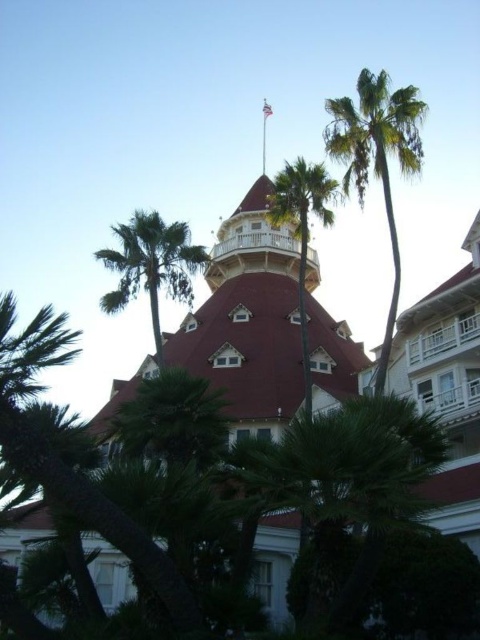
Question: Which point is closer to the camera?

Choices:
 (A) green leafy palm tree at upper center
 (B) green leafy palm tree at right

Answer: (B)

Question: Can you confirm if green leafy palm tree at right is smaller than green leafy palm tree at upper center?

Choices:
 (A) yes
 (B) no

Answer: (B)

Question: Does green leafy palm tree at upper center appear under green leafy palm tree at center?

Choices:
 (A) yes
 (B) no

Answer: (A)

Question: Among these points, which one is farthest from the camera?

Choices:
 (A) (313, 189)
 (B) (169, 234)
 (C) (268, 413)
 (D) (349, 157)

Answer: (C)

Question: Which is nearer to the green leafy palm tree at upper center?

Choices:
 (A) green leafy palm tree at right
 (B) green leafy palm tree at center

Answer: (B)

Question: Is green leafy palm tree at upper center to the right of green leafy palm tree at center from the viewer's perspective?

Choices:
 (A) no
 (B) yes

Answer: (A)